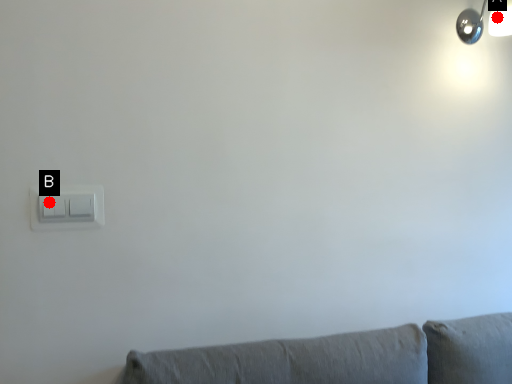
Question: Two points are circled on the image, labeled by A and B beside each circle. Which of the following is the closest to the observer?

Choices:
 (A) A is closer
 (B) B is closer

Answer: (B)